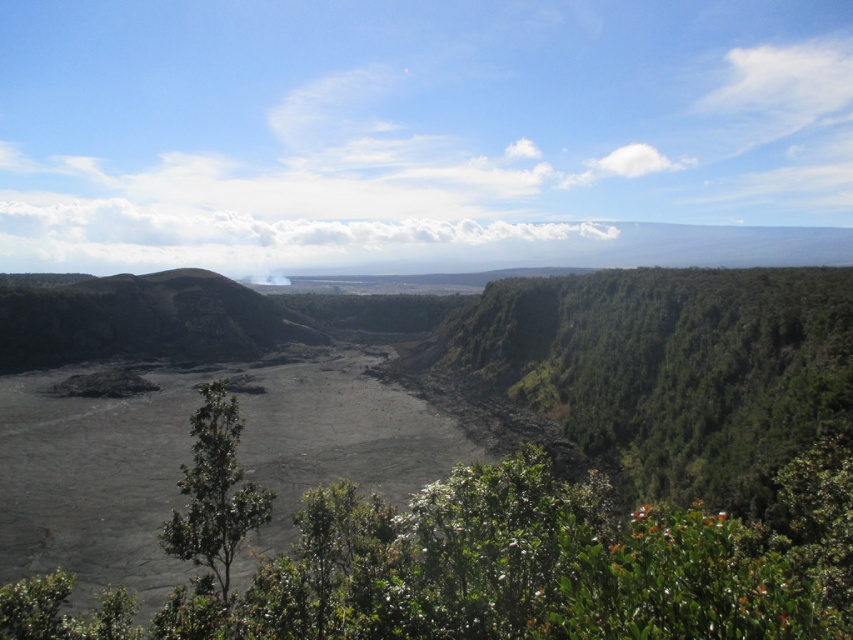
You are standing at the origin point of the coordinate system in the image. You want to reach the green leafy shrubs at center. In which direction should you move relative to your current position?

The green leafy shrubs at center are located at coordinate point [479,560], so you should move towards the right and slightly forward from your current position at the origin.

You are a botanist studying plant growth in volcanic areas. You observe the green leafy shrubs at center and the green leafy tree at center. Which of these two plants is taller?

The green leafy shrubs at center are taller than the green leafy tree at center according to the description provided.